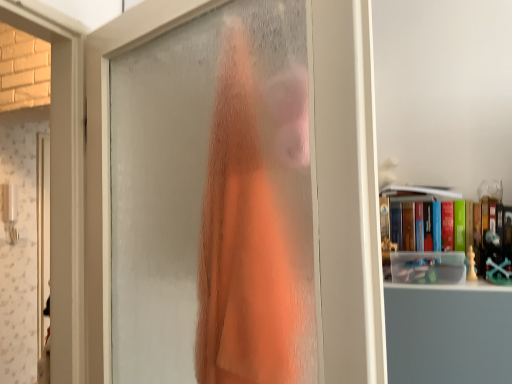
Question: Is orange fabric at center directly adjacent to hardcover book at upper right?

Choices:
 (A) yes
 (B) no

Answer: (B)

Question: Is orange fabric at center behind hardcover book at upper right?

Choices:
 (A) yes
 (B) no

Answer: (B)

Question: Does orange fabric at center have a larger size compared to hardcover book at upper right?

Choices:
 (A) no
 (B) yes

Answer: (A)

Question: Does orange fabric at center have a lesser height compared to hardcover book at upper right?

Choices:
 (A) no
 (B) yes

Answer: (A)

Question: Can you confirm if orange fabric at center is positioned to the right of hardcover book at upper right?

Choices:
 (A) no
 (B) yes

Answer: (A)

Question: Could you tell me if orange fabric at center is facing hardcover book at upper right?

Choices:
 (A) yes
 (B) no

Answer: (A)

Question: Does hardcover book at upper right appear on the right side of orange fabric at center?

Choices:
 (A) yes
 (B) no

Answer: (A)

Question: From the image's perspective, is hardcover book at upper right on top of orange fabric at center?

Choices:
 (A) no
 (B) yes

Answer: (A)

Question: From a real-world perspective, does hardcover book at upper right stand above orange fabric at center?

Choices:
 (A) no
 (B) yes

Answer: (A)

Question: Is the depth of hardcover book at upper right greater than that of orange fabric at center?

Choices:
 (A) no
 (B) yes

Answer: (B)

Question: Is hardcover book at upper right at the left side of orange fabric at center?

Choices:
 (A) no
 (B) yes

Answer: (A)

Question: Can you confirm if hardcover book at upper right is bigger than orange fabric at center?

Choices:
 (A) yes
 (B) no

Answer: (A)

Question: Can you confirm if hardcover book at upper right is positioned to the right of frosted glass door at center?

Choices:
 (A) no
 (B) yes

Answer: (B)